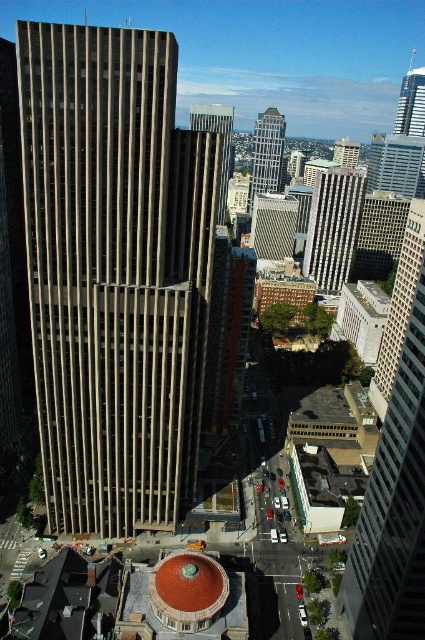
Can you confirm if beige concrete skyscraper at center is positioned to the left of smooth concrete skyscraper at center?

Correct, you'll find beige concrete skyscraper at center to the left of smooth concrete skyscraper at center.

Is point (102, 365) farther from camera compared to point (206, 125)?

No, it is not.

Locate an element on the screen. beige concrete skyscraper at center is located at coordinates (115, 273).

Consider the image. Does matte glass building at center appear over glassy silver skyscraper at center?

Actually, matte glass building at center is below glassy silver skyscraper at center.

From the picture: Measure the distance between point (x=254, y=198) and camera.

Point (x=254, y=198) and camera are 442.28 meters apart from each other.

Is point (254, 250) farther from viewer compared to point (255, 145)?

No.

Image resolution: width=425 pixels, height=640 pixels. I want to click on matte glass building at center, so click(274, 225).

Is the position of beige concrete skyscraper at center more distant than that of matte glass building at center?

That is False.

Does point (37, 163) come closer to viewer compared to point (285, 228)?

Yes, point (37, 163) is closer to viewer.

The height and width of the screenshot is (640, 425). In order to click on beige concrete skyscraper at center in this screenshot , I will do `click(115, 273)`.